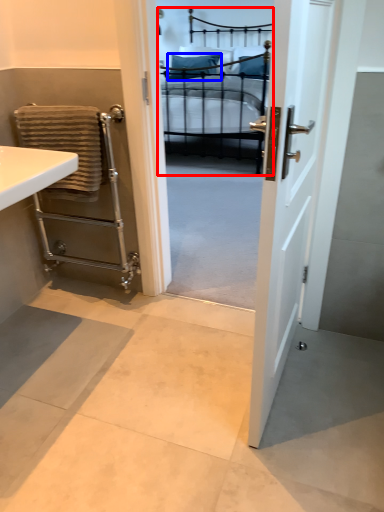
Question: Which object appears farthest to the camera in this image, bed (highlighted by a red box) or pillow (highlighted by a blue box)?

Choices:
 (A) bed
 (B) pillow

Answer: (B)